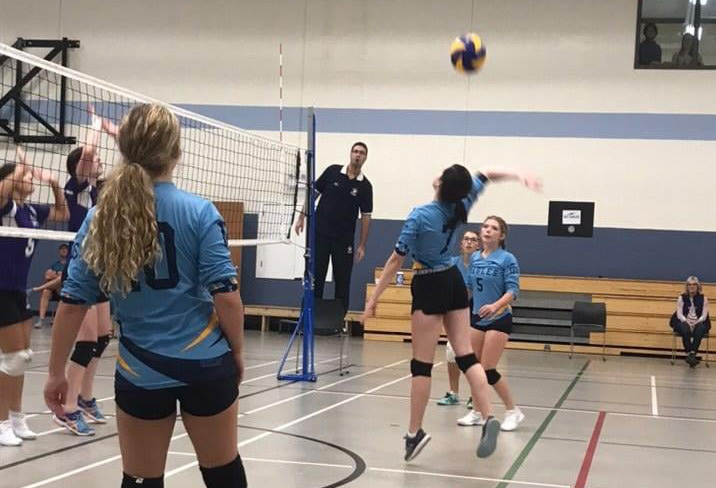
Image resolution: width=716 pixels, height=488 pixels. Find the location of `window`. window is located at coordinates (664, 17).